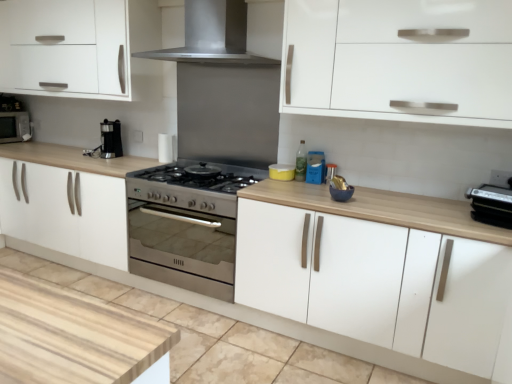
Identify the location of free space in front of metallic silver toaster at center, the 2th appliance positioned from the right. The image size is (512, 384). (327, 192).